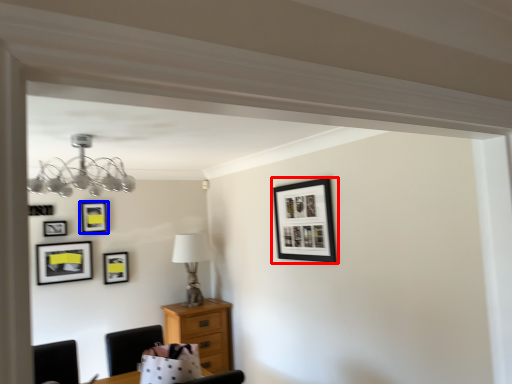
Question: Which object appears closest to the camera in this image, picture frame (highlighted by a red box) or picture frame (highlighted by a blue box)?

Choices:
 (A) picture frame
 (B) picture frame

Answer: (A)